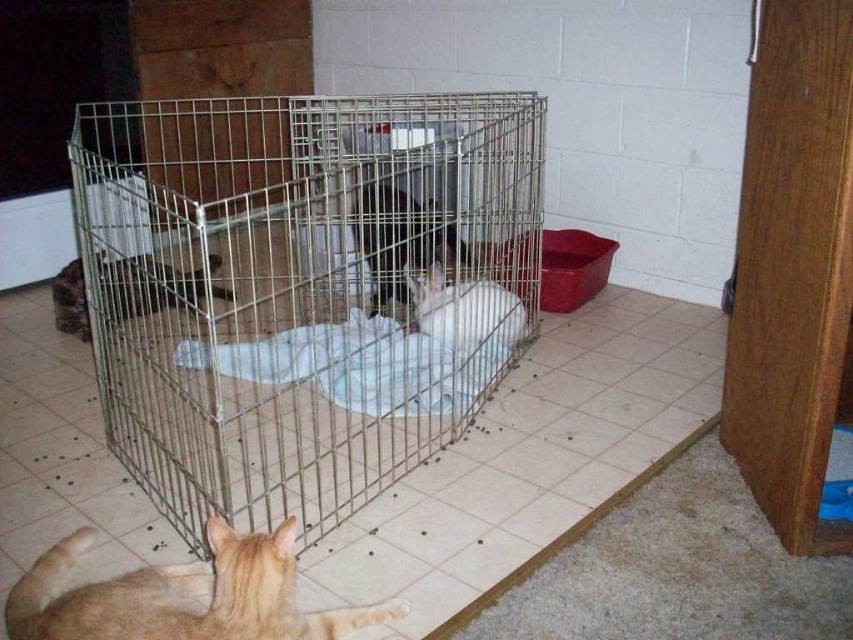
Is metal wire cage at center taller than brown fur cat at center?

Yes, metal wire cage at center is taller than brown fur cat at center.

Consider the image. Is metal wire cage at center above brown fur cat at center?

Yes.

Does point (321, 342) come behind point (386, 282)?

That is False.

You are a GUI agent. You are given a task and a screenshot of the screen. Output one action in this format:
    pyautogui.click(x=<x>, y=<y>)
    Task: Click on the metal wire cage at center
    
    Given the screenshot: What is the action you would take?
    pyautogui.click(x=302, y=289)

Is point (236, 625) positioned before point (434, 314)?

Yes, point (236, 625) is in front of point (434, 314).

Is point (54, 570) positioned behind point (515, 330)?

No, (54, 570) is closer to viewer.

Describe the element at coordinates (183, 595) in the screenshot. I see `orange fur cat at lower left` at that location.

Locate an element on the screen. The height and width of the screenshot is (640, 853). orange fur cat at lower left is located at coordinates (183, 595).

Is metal wire cage at center further to camera compared to fluffy brown cat at center?

No, it is not.

Between point (347, 269) and point (125, 285), which one is positioned in front?

Point (125, 285)

Where is `metal wire cage at center`? metal wire cage at center is located at coordinates (302, 289).